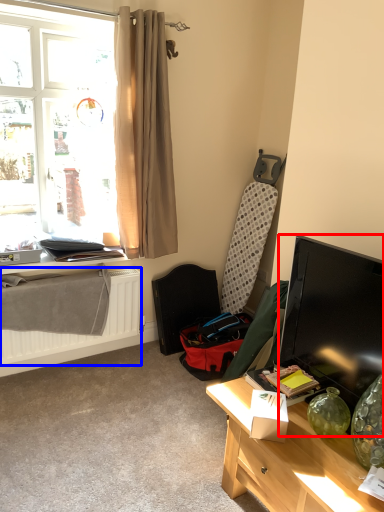
Question: Which object appears closest to the camera in this image, television (highlighted by a red box) or radiator (highlighted by a blue box)?

Choices:
 (A) television
 (B) radiator

Answer: (A)